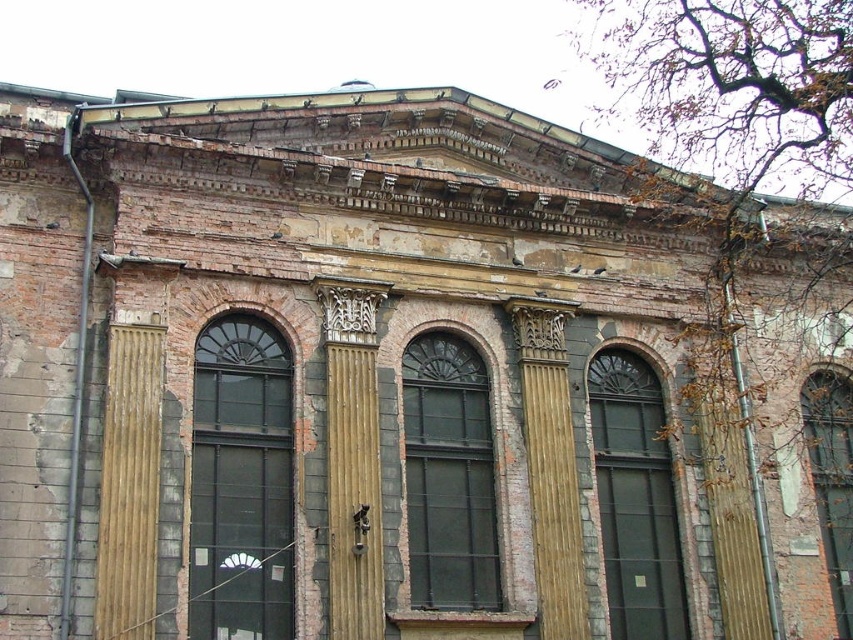
You are standing in front of the old building and want to locate the dark gray glass window at center left. What are the coordinates of its position?

The dark gray glass window at center left is located at coordinates (x=241, y=483).

You are standing in front of the old building and notice two points marked on its facade. The first point is at coordinate point (241, 454) and the second is at point (402, 353). Which point is closer to you?

Point (241, 454) is closer to the viewer than point (402, 353).

You are standing in front of the old building and want to locate the dark gray glass window at center left. According to the coordinates provided, where should you look relative to the building?

The dark gray glass window at center left is located at coordinates 0.756 on the x axis and 0.284 on the y axis relative to the building.